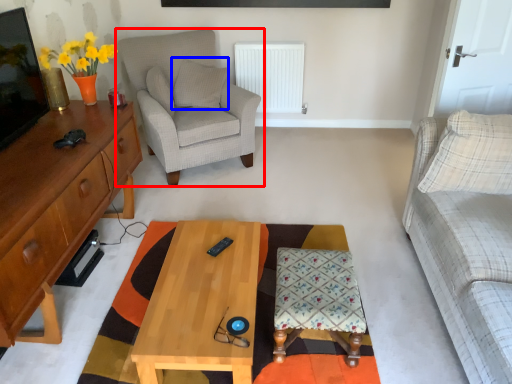
Question: Which object is further to the camera taking this photo, chair (highlighted by a red box) or pillow (highlighted by a blue box)?

Choices:
 (A) chair
 (B) pillow

Answer: (B)